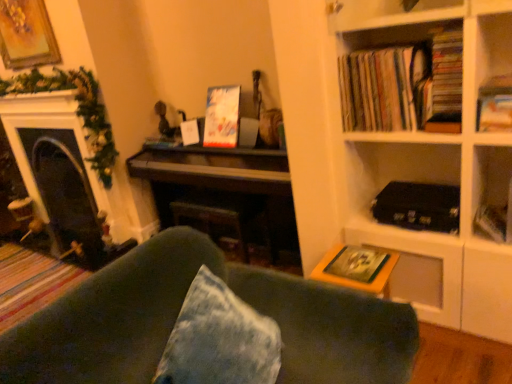
Find the location of a particular element. The width and height of the screenshot is (512, 384). free space above yellow matte paperback book at lower right, acting as the second paperback book starting from the right (from a real-world perspective) is located at coordinates (354, 257).